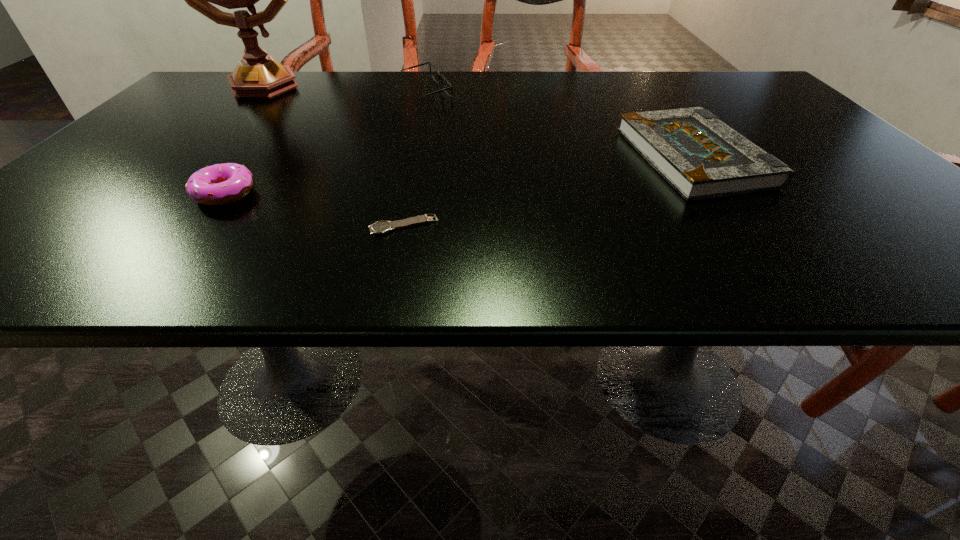
Find the location of a particular element. vacant space located on the back of the shortest object is located at coordinates (420, 151).

Image resolution: width=960 pixels, height=540 pixels. I want to click on globe located at the far edge, so click(x=257, y=75).

Where is `spectacles present at the far edge`? This screenshot has width=960, height=540. spectacles present at the far edge is located at coordinates (447, 87).

The image size is (960, 540). What are the coordinates of `object situated at the left edge` in the screenshot? It's located at point(257,75).

Where is `object at the far left corner`? object at the far left corner is located at coordinates (257, 75).

Identify the location of vacant space at the far edge. Image resolution: width=960 pixels, height=540 pixels. pos(611,83).

Image resolution: width=960 pixels, height=540 pixels. I want to click on vacant space at the near edge, so click(697, 262).

Identify the location of vacant area at the left edge of the desktop. This screenshot has width=960, height=540. (48, 235).

In the image, there is a desktop. Where is `vacant space at the right edge`? vacant space at the right edge is located at coordinates (765, 135).

Locate an element on the screen. The height and width of the screenshot is (540, 960). vacant space at the far left corner of the desktop is located at coordinates (180, 104).